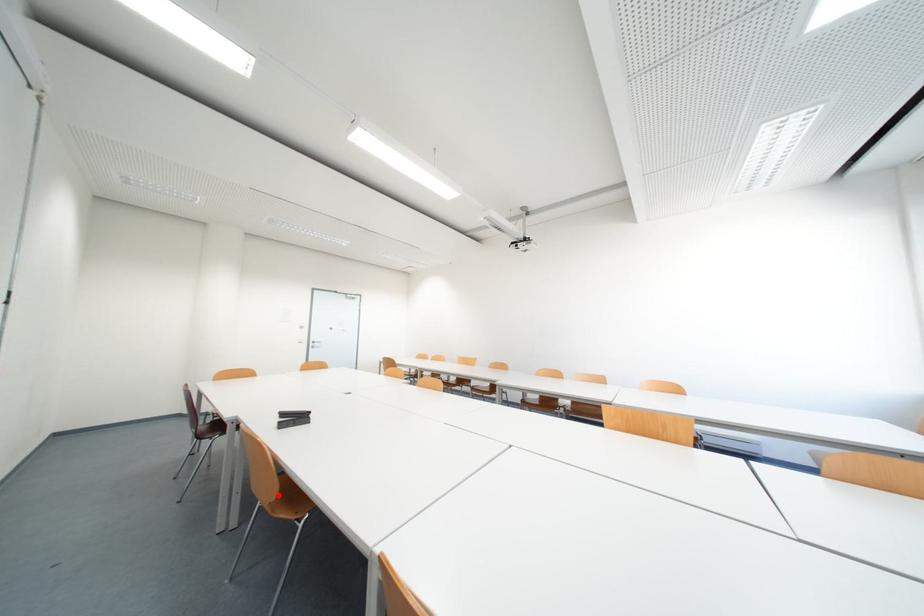
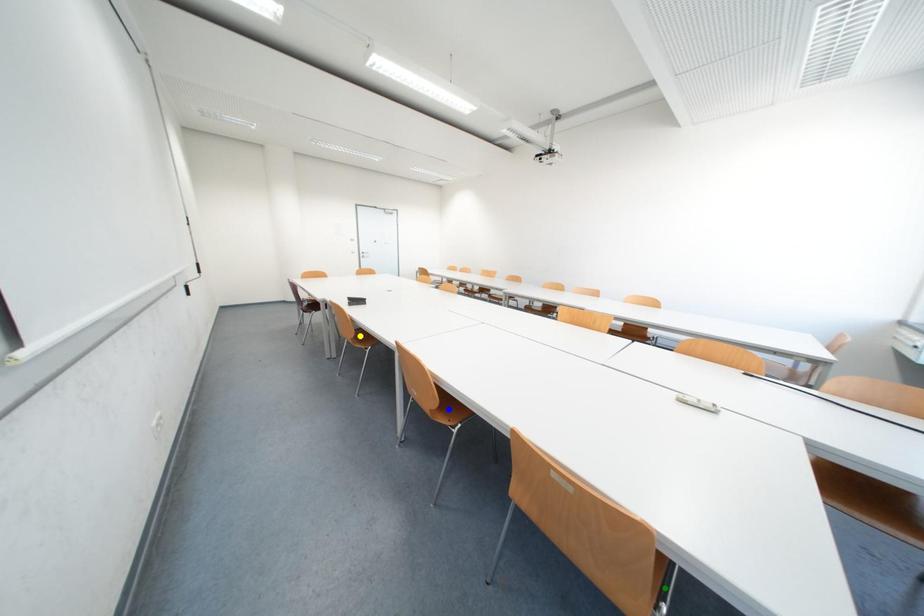
Question: I am providing you with two images of the same scene from different viewpoints. A red point is marked on the first image. You are given multiple points on the second image. In image 2, which mark is for the same physical point as the one in image 1?

Choices:
 (A) blue point
 (B) green point
 (C) yellow point

Answer: (C)